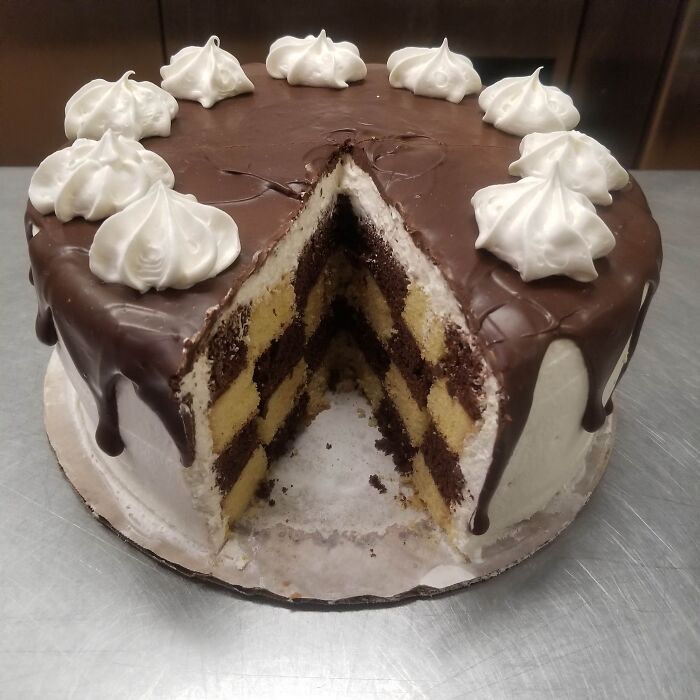
The width and height of the screenshot is (700, 700). In order to click on circular metal tray in this screenshot , I will do `click(346, 603)`.